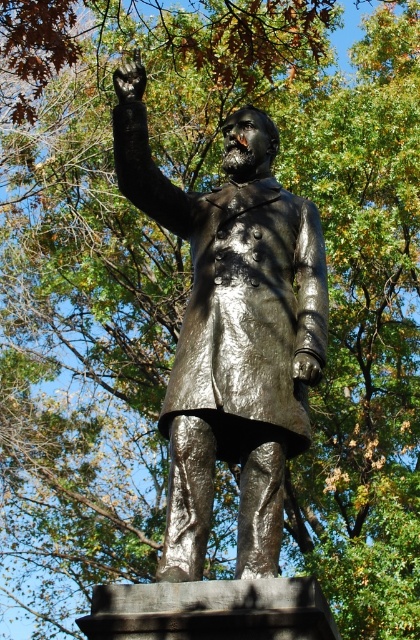
You are an art conservator examining the statue and the glove in the image. Which object is closer to you, the shiny bronze statue at center or the shiny black glove at upper center?

The shiny bronze statue at center is closer to you because it is in front of the shiny black glove at upper center.

You are an art conservator assessing the statue. You need to know if the shiny bronze statue at center is wider than the shiny black glove at upper center. Can you confirm this?

The shiny bronze statue at center is wider than the shiny black glove at upper center, so yes, the statue is wider than the glove.